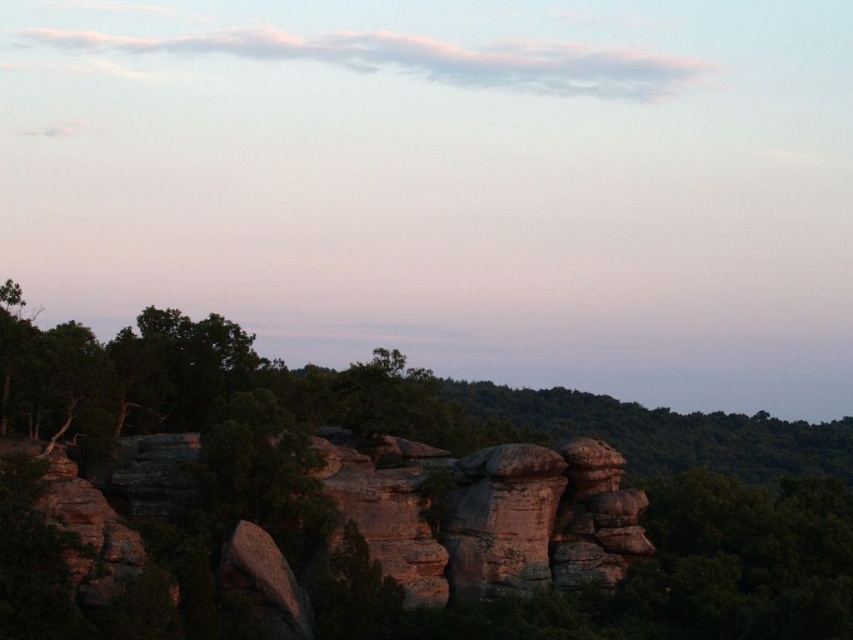
Between smooth rock formation at center and green leafy tree at center, which one has less height?

green leafy tree at center

Locate an element on the screen. smooth rock formation at center is located at coordinates (450, 182).

Describe the element at coordinates (450, 182) in the screenshot. I see `smooth rock formation at center` at that location.

Locate an element on the screen. smooth rock formation at center is located at coordinates (450, 182).